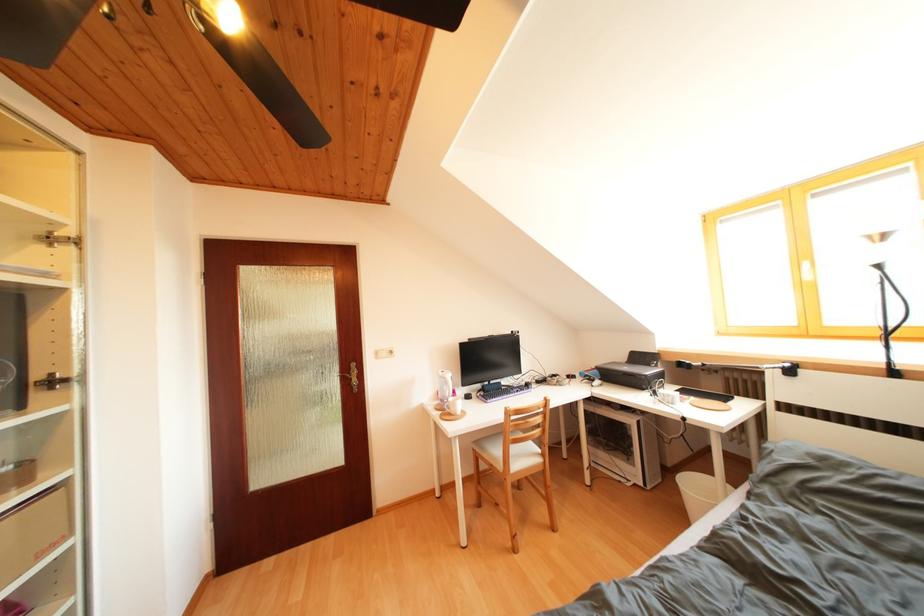
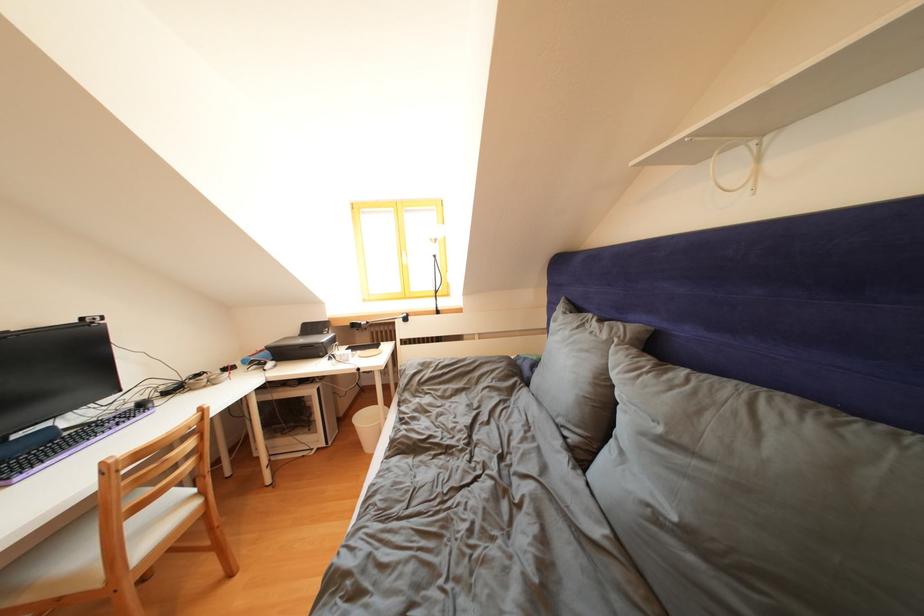
Question: The images are taken continuously from a first-person perspective. In which direction is your viewpoint rotating?

Choices:
 (A) Left
 (B) Right
 (C) Up
 (D) Down

Answer: (B)